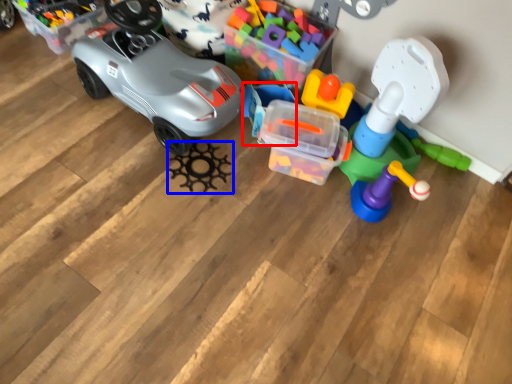
Question: Among these objects, which one is farthest to the camera, toy (highlighted by a red box) or toy (highlighted by a blue box)?

Choices:
 (A) toy
 (B) toy

Answer: (A)